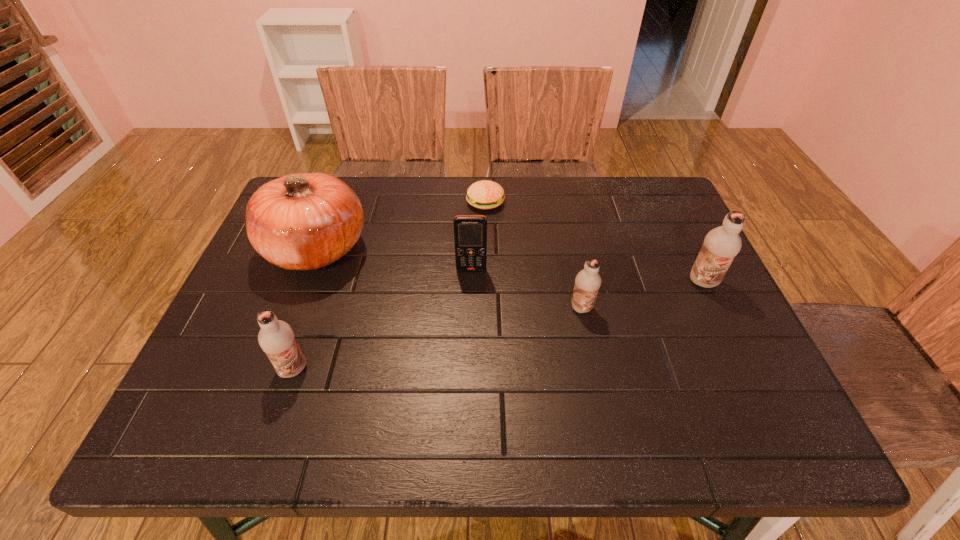
Where is `the leftmost chocolate milk`? the leftmost chocolate milk is located at coordinates (276, 338).

The image size is (960, 540). In order to click on the nearest chocolate milk in this screenshot , I will do `click(276, 338)`.

Find the location of a particular element. the second nearest object is located at coordinates (587, 282).

Find the location of a particular element. The height and width of the screenshot is (540, 960). the second nearest chocolate milk is located at coordinates (587, 282).

What are the coordinates of `the rightmost chocolate milk` in the screenshot? It's located at (721, 244).

This screenshot has width=960, height=540. I want to click on the farthest chocolate milk, so click(x=721, y=244).

Identify the location of the farthest object. (485, 194).

At what (x,y) coordinates should I click in order to perform the action: click on the shortest object. Please return your answer as a coordinate pair (x, y). Looking at the image, I should click on (485, 194).

The image size is (960, 540). I want to click on pumpkin, so click(x=306, y=221).

This screenshot has width=960, height=540. In order to click on cellular telephone in this screenshot , I will do `click(470, 231)`.